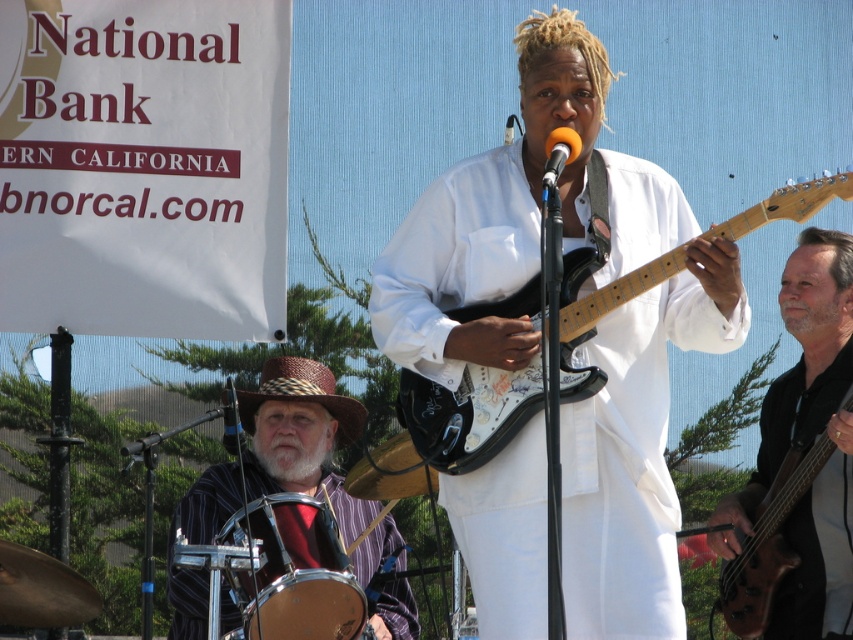
You are a photographer at the live musical performance and want to capture a closeup of the striped fabric hat at left. Where should you aim your camera to ensure the hat is centered in the photo?

You should aim your camera at the point [300,436] to center the striped fabric hat at left in the photo.

You are standing at the point marked as point (450, 195) in the image. The stage is 50 meters away from you. Can you see the drummer clearly?

The distance between you and the drummer is 33.46 meters, which is less than the 50 meters to the stage. Therefore, you can see the drummer clearly.

You need to place a rectangular box that is 1.2 meters wide between the shiny silver drum at lower left and the brown wood bass guitar at lower right. Based on their widths, will the box fit between them?

The shiny silver drum at lower left is wider than the brown wood bass guitar at lower right. Since the box is 1.2 meters wide, and the total width of both objects combined is not provided, it is impossible to determine if the box will fit between them based solely on their individual widths.